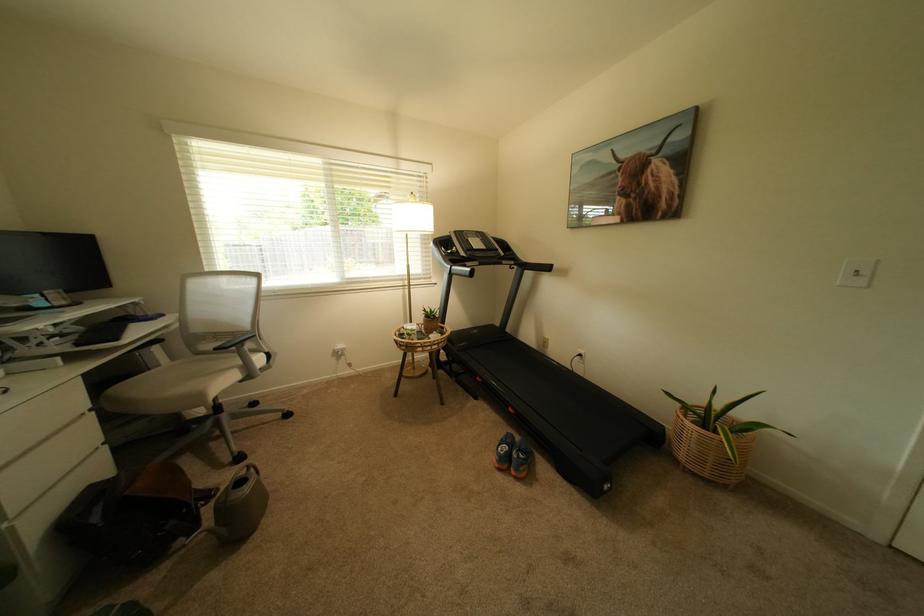
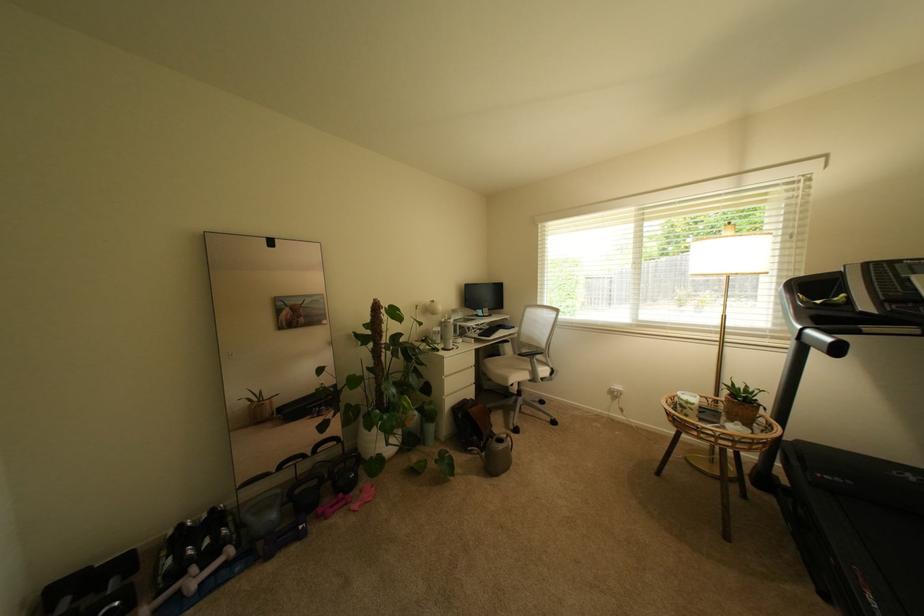
Find the pixel in the second image that matches point 211,419 in the first image.

(521, 395)